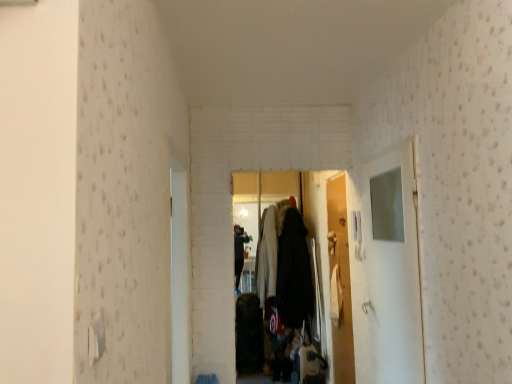
Question: Would you say white glossy door at center, which appears as the first door when viewed from the left, is part of white glossy door at center, the second door in the front-to-back sequence,'s contents?

Choices:
 (A) no
 (B) yes

Answer: (A)

Question: From a real-world perspective, does white glossy door at center, the second door in the front-to-back sequence, stand above white glossy door at center, the second door in the right-to-left sequence?

Choices:
 (A) yes
 (B) no

Answer: (B)

Question: Can you confirm if white glossy door at center, the 1th door when ordered from back to front, is bigger than white glossy door at center, the 2th door when ordered from back to front?

Choices:
 (A) yes
 (B) no

Answer: (A)

Question: From a real-world perspective, is white glossy door at center, which ranks as the 1th door in right-to-left order, physically below white glossy door at center, the 2th door when ordered from back to front?

Choices:
 (A) yes
 (B) no

Answer: (A)

Question: Is white glossy door at center, acting as the second door starting from the left, aimed at white glossy door at center, the first door in the front-to-back sequence?

Choices:
 (A) yes
 (B) no

Answer: (B)

Question: From their relative heights in the image, would you say white glossy door at center, which ranks as the 1th door in right-to-left order, is taller or shorter than white glossy door at center, which appears as the first door when viewed from the left?

Choices:
 (A) tall
 (B) short

Answer: (A)

Question: Looking at their shapes, would you say white glossy door at center, the second door in the front-to-back sequence, is wider or thinner than white glossy door at center, the first door in the front-to-back sequence?

Choices:
 (A) wide
 (B) thin

Answer: (B)

Question: From a real-world perspective, is white glossy door at center, the second door in the front-to-back sequence, above or below white glossy door at center, the 2th door when ordered from back to front?

Choices:
 (A) below
 (B) above

Answer: (A)

Question: Would you say white glossy door at center, the 1th door when ordered from back to front, is inside or outside white glossy door at center, the second door in the right-to-left sequence?

Choices:
 (A) inside
 (B) outside

Answer: (B)

Question: Is transparent glass door at right in front of or behind white glossy door at center, the second door in the right-to-left sequence, in the image?

Choices:
 (A) behind
 (B) front

Answer: (A)

Question: Based on their sizes in the image, would you say transparent glass door at right is bigger or smaller than white glossy door at center, the second door in the right-to-left sequence?

Choices:
 (A) big
 (B) small

Answer: (A)

Question: From the image's perspective, is transparent glass door at right positioned above or below white glossy door at center, the 2th door when ordered from back to front?

Choices:
 (A) above
 (B) below

Answer: (B)

Question: Does point (394, 258) appear closer or farther from the camera than point (178, 213)?

Choices:
 (A) farther
 (B) closer

Answer: (B)

Question: Is white glossy door at center, acting as the second door starting from the left, inside the boundaries of transparent glass door at right, or outside?

Choices:
 (A) inside
 (B) outside

Answer: (B)

Question: From their relative heights in the image, would you say white glossy door at center, the 1th door when ordered from back to front, is taller or shorter than transparent glass door at right?

Choices:
 (A) short
 (B) tall

Answer: (B)